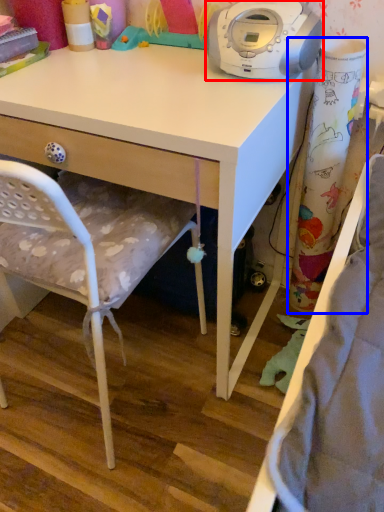
Question: Among these objects, which one is nearest to the camera, home appliance (highlighted by a red box) or curtain (highlighted by a blue box)?

Choices:
 (A) home appliance
 (B) curtain

Answer: (A)